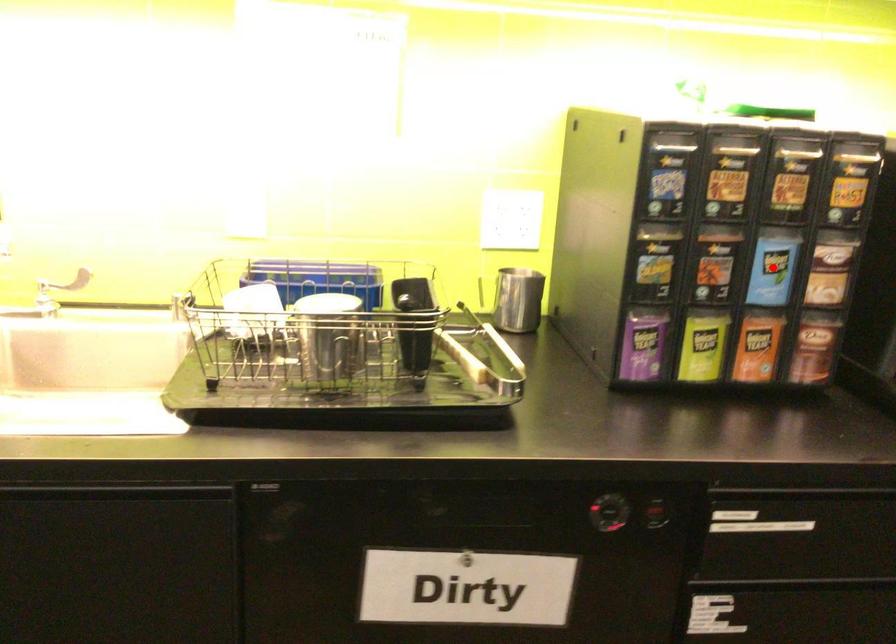
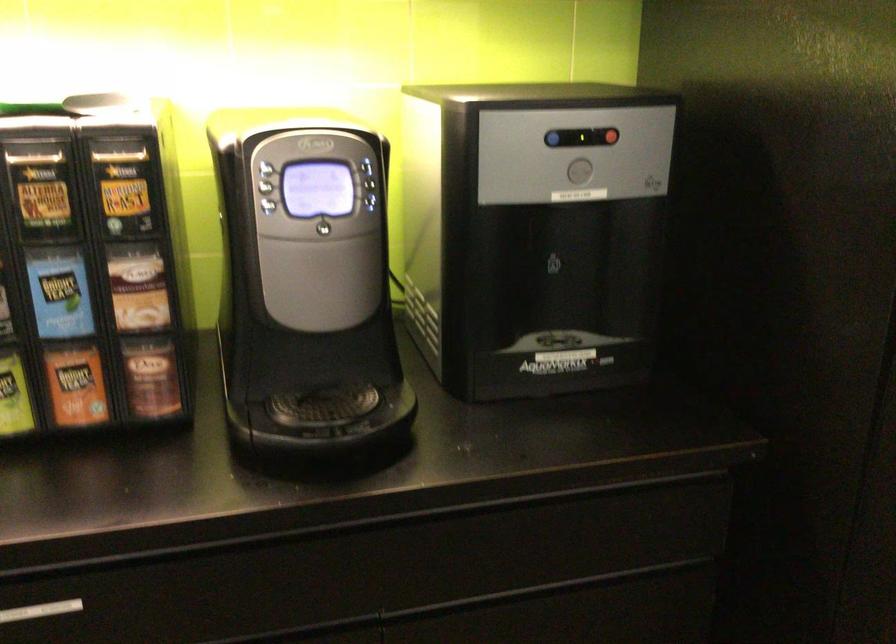
Where in the second image is the point corresponding to the highlighted location from the first image?

(58, 292)